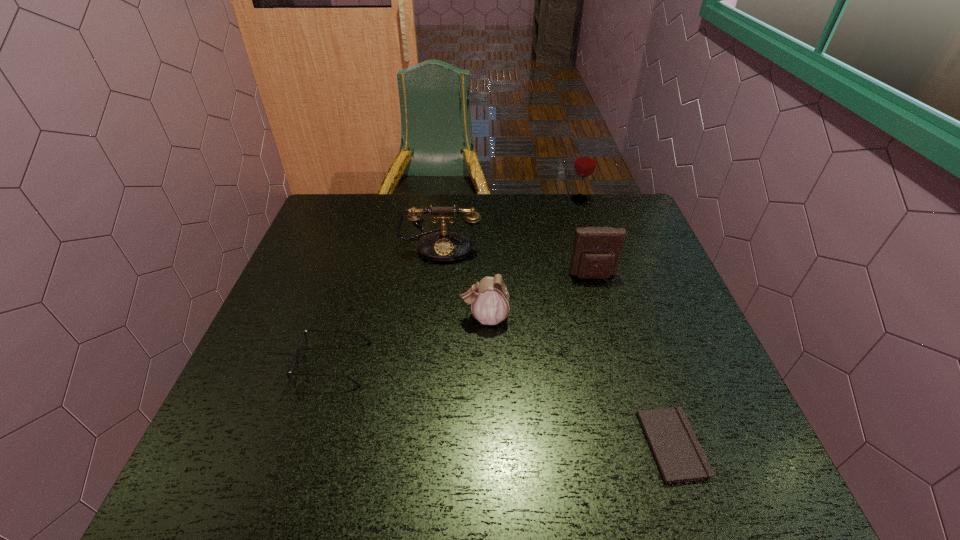
Image resolution: width=960 pixels, height=540 pixels. In order to click on the nearest object in this screenshot , I will do `click(680, 458)`.

Locate an element on the screen. The width and height of the screenshot is (960, 540). vacant space located 0.190m on the front of the farthest object is located at coordinates (591, 240).

Locate an element on the screen. The image size is (960, 540). vacant space located on the dial of the telephone is located at coordinates (434, 307).

Find the location of a particular element. The height and width of the screenshot is (540, 960). vacant space situated with an open flap on the farther pouch is located at coordinates (606, 322).

At what (x,y) coordinates should I click in order to perform the action: click on free space located on the front-facing side of the fourth farthest object. Please return your answer as a coordinate pair (x, y). Looking at the image, I should click on (363, 318).

This screenshot has height=540, width=960. What are the coordinates of `blank space located on the front-facing side of the fourth farthest object` in the screenshot? It's located at (371, 318).

The width and height of the screenshot is (960, 540). I want to click on vacant space located on the front-facing side of the fourth farthest object, so click(x=416, y=318).

You are a GUI agent. You are given a task and a screenshot of the screen. Output one action in this format:
    pyautogui.click(x=<x>, y=<y>)
    Task: Click on the vacant space located 0.270m with the lenses facing outward on the second nearest object
    This screenshot has width=960, height=540.
    Given the screenshot: What is the action you would take?
    pyautogui.click(x=489, y=364)

Locate an element on the screen. vacant space located 0.160m on the back of the checkbook is located at coordinates (639, 348).

Identify the location of glass located in the far edge section of the desktop. Image resolution: width=960 pixels, height=540 pixels. [x=585, y=162].